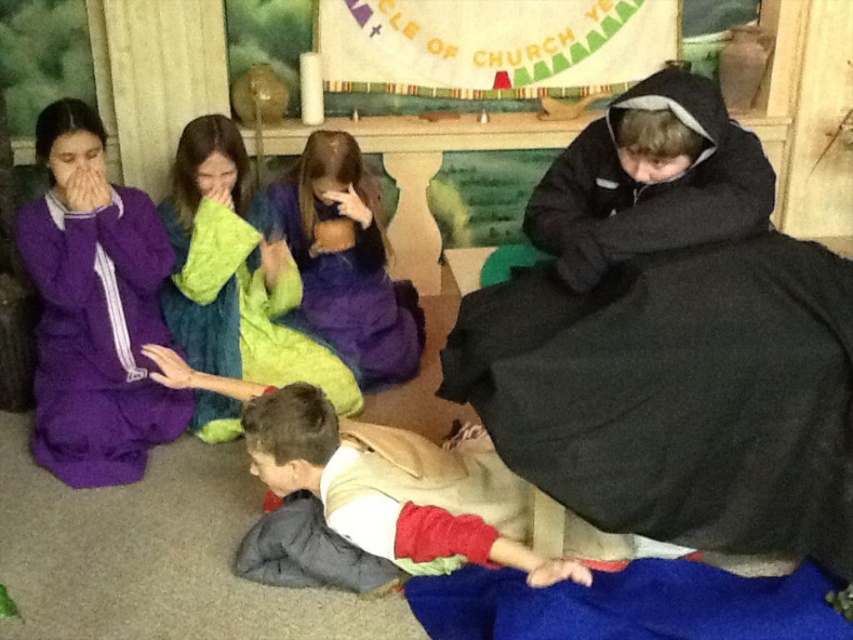
You are a photographer trying to capture a candid shot of the tan fabric child at lower center without including the purple fleece robe at left in the frame. Is this possible given their positions?

The purple fleece robe at left is further to the viewer than the tan fabric child at lower center. Since the robe is closer to you, it would block the view of the child unless you move your position to avoid it. Therefore, you can adjust your angle or move around the robe to capture the child without the robe in the frame.

You are standing at the entrance of the room and want to locate the purple fleece robe at left. Based on the coordinates provided, in which direction should you look to find it?

The purple fleece robe at left is located at coordinates point (94, 308), so you should look towards the lower left area of the room to find it.

You are a photographer trying to capture a candid shot of the scene. You want to ensure both the purple fleece robe at left and the tan fabric child at lower center are visible in the frame. Based on their positions, which object is closer to the left edge of the image?

The purple fleece robe at left is closer to the left edge of the image because it is positioned to the left of the tan fabric child at lower center.